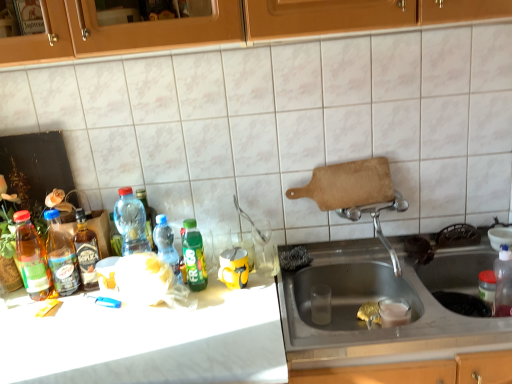
This screenshot has width=512, height=384. Find the location of `free point in front of translucent plastic bottle at left, positioned as the second bottle in left-to-right order`. free point in front of translucent plastic bottle at left, positioned as the second bottle in left-to-right order is located at coordinates (51, 318).